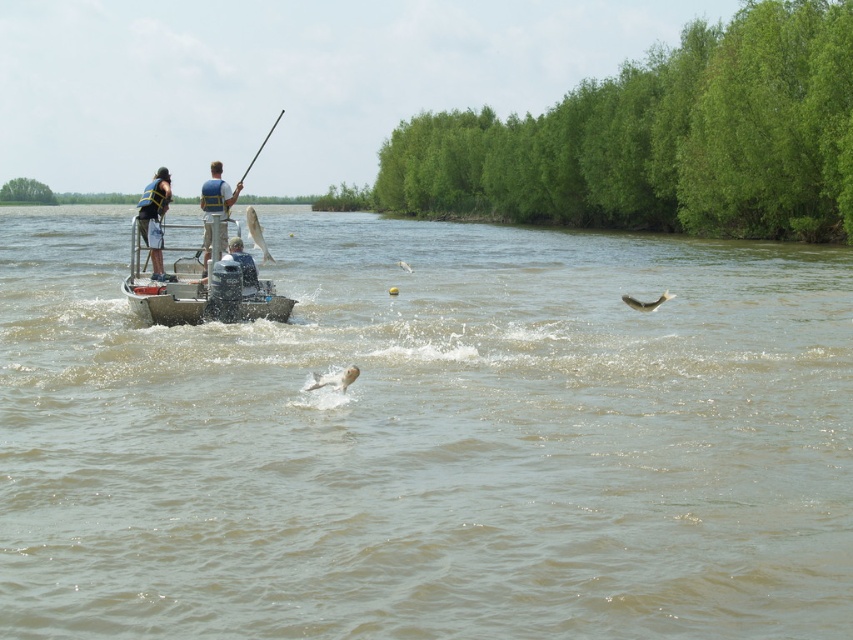
Question: Is matte black life vest at left to the left of white matte fish at upper center from the viewer's perspective?

Choices:
 (A) no
 (B) yes

Answer: (B)

Question: Does light blue life vest at center have a smaller size compared to shiny silver fish at center?

Choices:
 (A) yes
 (B) no

Answer: (B)

Question: Which point is farther to the camera?

Choices:
 (A) gray fabric shirt at center
 (B) brown murky water at center

Answer: (A)

Question: Which object is closer to the camera taking this photo?

Choices:
 (A) matte black life vest at left
 (B) smooth fiberglass fishing pole at upper center
 (C) silvery metallic fish at center

Answer: (C)

Question: Can you confirm if gray fabric shirt at center is bigger than silvery metallic fish at center?

Choices:
 (A) yes
 (B) no

Answer: (B)

Question: Which is nearer to the silvery metallic fish at center?

Choices:
 (A) shiny silver fish at center
 (B) brown murky water at center
 (C) metallic gray boat at center
 (D) light blue life vest at center

Answer: (C)